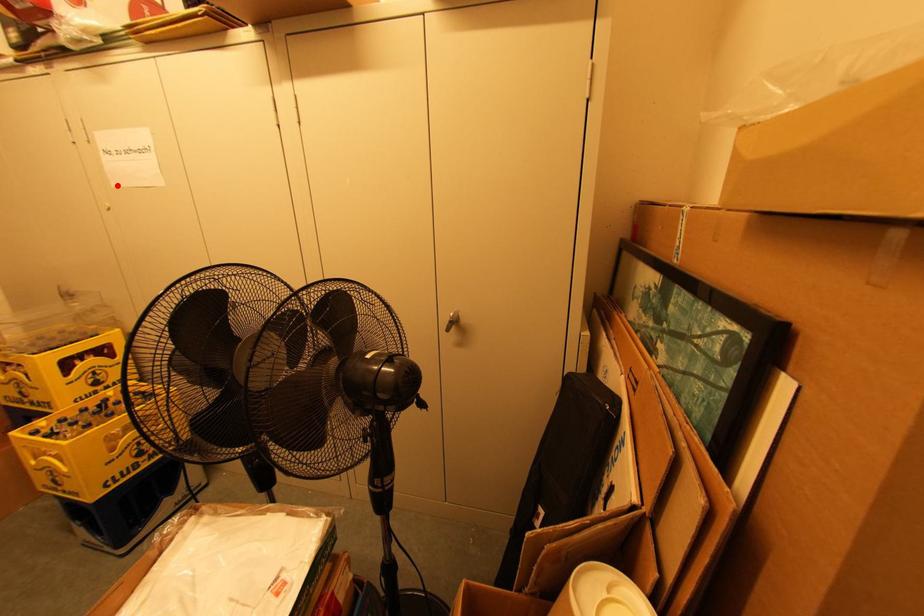
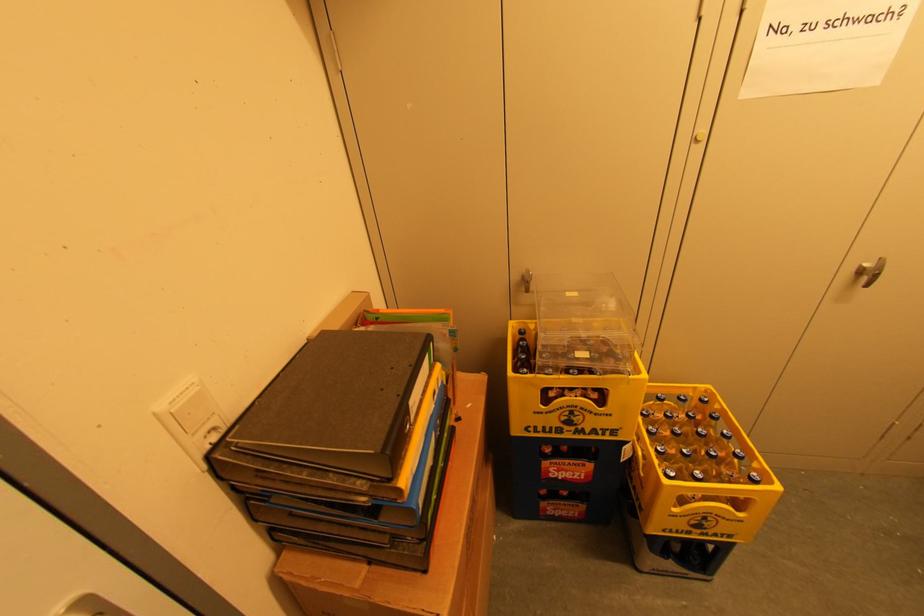
Question: I am providing you with two images of the same scene from different viewpoints. Image1 has a red point marked. In image2, the corresponding 3D location appears at what relative position? Reply with the corresponding letter.

Choices:
 (A) Closer
 (B) Farther

Answer: (A)